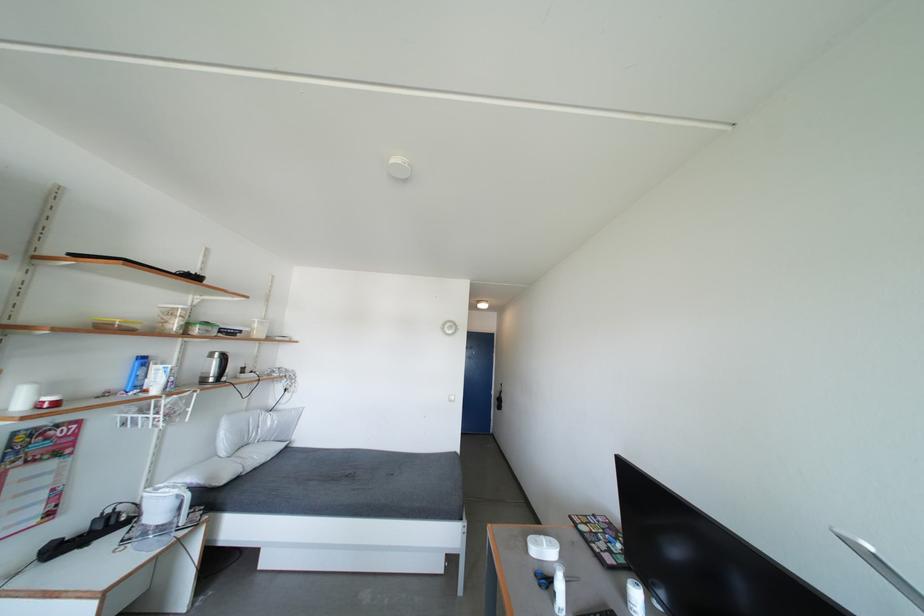
What do you see at coordinates (213, 371) in the screenshot? I see `the kettle handle` at bounding box center [213, 371].